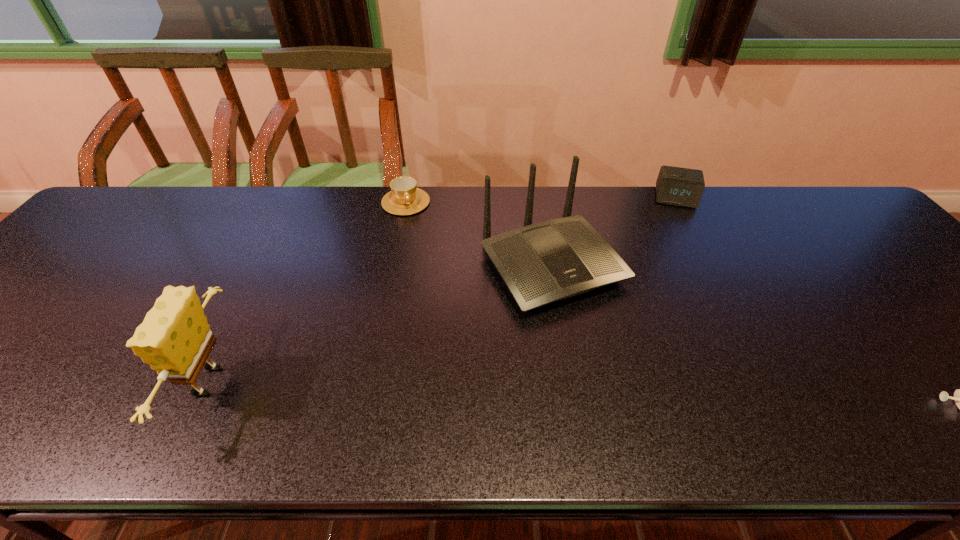
Identify the location of alarm clock positioned at the far edge. Image resolution: width=960 pixels, height=540 pixels. (677, 186).

The width and height of the screenshot is (960, 540). I want to click on object that is at the near edge, so click(x=175, y=339).

The height and width of the screenshot is (540, 960). Identify the location of vacant space at the far edge. (284, 193).

Locate an element on the screen. This screenshot has height=540, width=960. vacant space at the near edge of the desktop is located at coordinates (471, 394).

At what (x,y) coordinates should I click in order to perform the action: click on free space at the left edge of the desktop. Please return your answer as a coordinate pair (x, y). Looking at the image, I should click on (86, 255).

Find the location of a particular element. vacant space at the far right corner of the desktop is located at coordinates (843, 212).

The height and width of the screenshot is (540, 960). What are the coordinates of `free point between the third nearest object and the second object from left to right` in the screenshot? It's located at (479, 233).

This screenshot has height=540, width=960. In order to click on vacant space in between the fourth object from right to left and the router in this screenshot , I will do `click(479, 233)`.

Identify the location of vacant area between the third tallest object and the leftmost object. (440, 290).

Locate an element on the screen. The width and height of the screenshot is (960, 540). empty location between the third object from left to right and the cup is located at coordinates (479, 233).